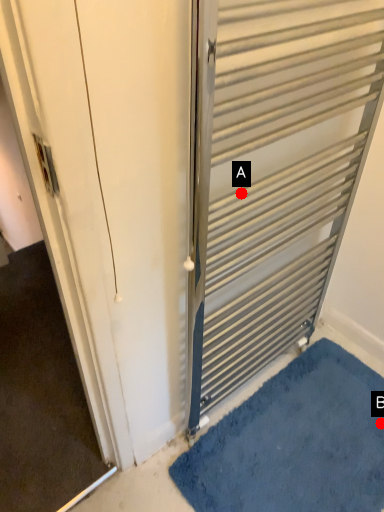
Question: Two points are circled on the image, labeled by A and B beside each circle. Which point appears farthest from the camera in this image?

Choices:
 (A) A is further
 (B) B is further

Answer: (B)